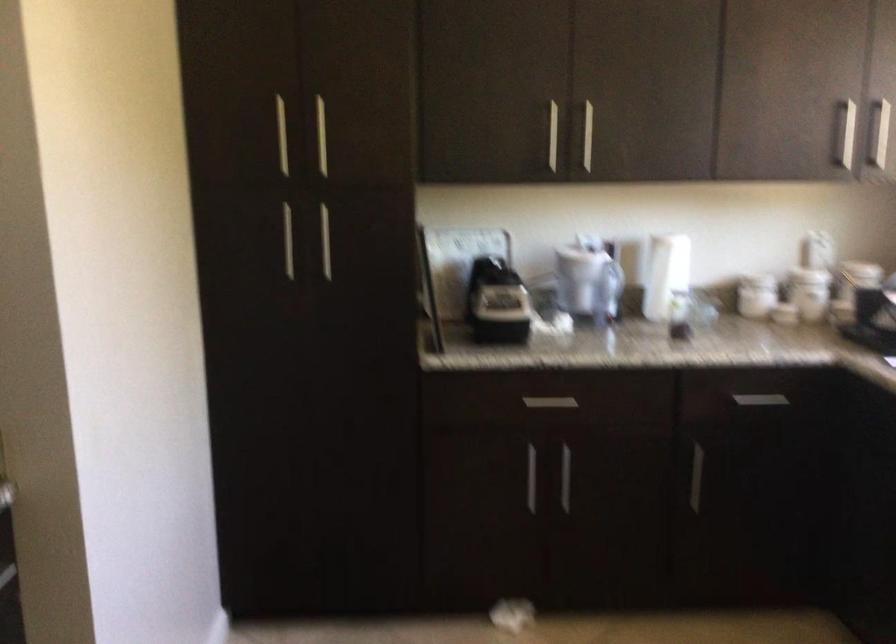
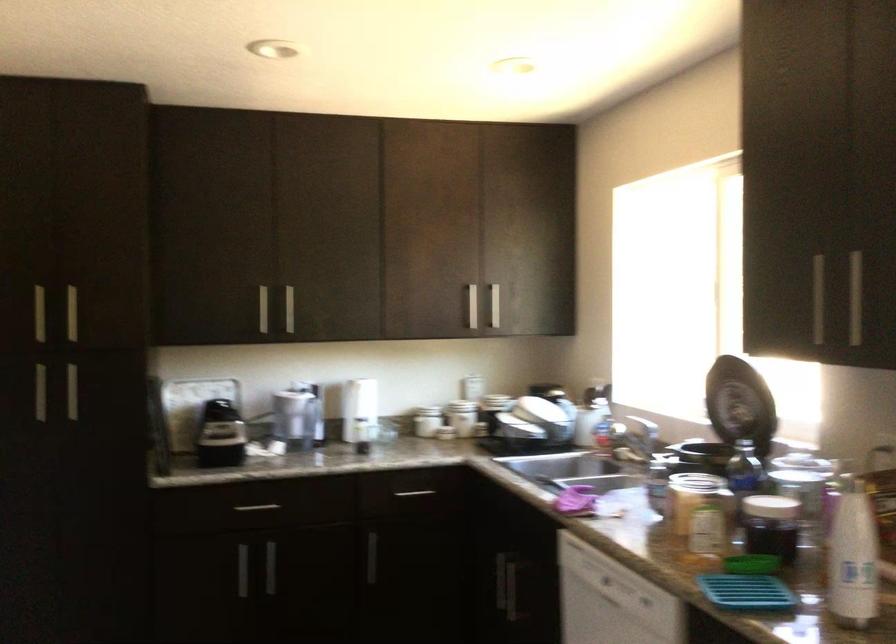
The point at [543,399] is marked in the first image. Where is the corresponding point in the second image?

(256, 507)